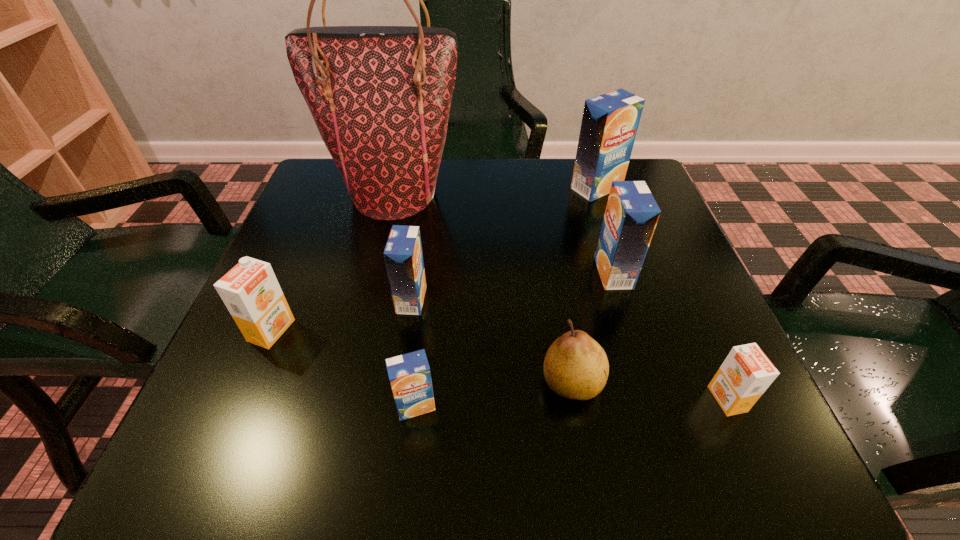
Locate an element on the screen. This screenshot has height=540, width=960. free space located on the left of the rightmost orange juice is located at coordinates (592, 399).

The height and width of the screenshot is (540, 960). In order to click on handbag that is at the far edge in this screenshot , I will do `click(380, 96)`.

You are a GUI agent. You are given a task and a screenshot of the screen. Output one action in this format:
    pyautogui.click(x=<x>, y=<y>)
    Task: Click on the orange_juice that is at the far edge
    Image resolution: width=960 pixels, height=540 pixels.
    Given the screenshot: What is the action you would take?
    pyautogui.click(x=610, y=121)

Identify the location of handbag present at the left edge. This screenshot has width=960, height=540. (380, 96).

Identify the location of orange juice that is at the left edge. Image resolution: width=960 pixels, height=540 pixels. (250, 290).

Where is `object that is at the far left corner`? This screenshot has width=960, height=540. object that is at the far left corner is located at coordinates (380, 96).

Find the location of a particular element. The width and height of the screenshot is (960, 540). object present at the far right corner is located at coordinates (610, 121).

I want to click on object that is at the near right corner, so click(x=746, y=373).

Identify the location of free region at the far edge. Image resolution: width=960 pixels, height=540 pixels. (534, 178).

The image size is (960, 540). In the image, there is a desktop. Find the location of `free space at the near edge`. free space at the near edge is located at coordinates (340, 429).